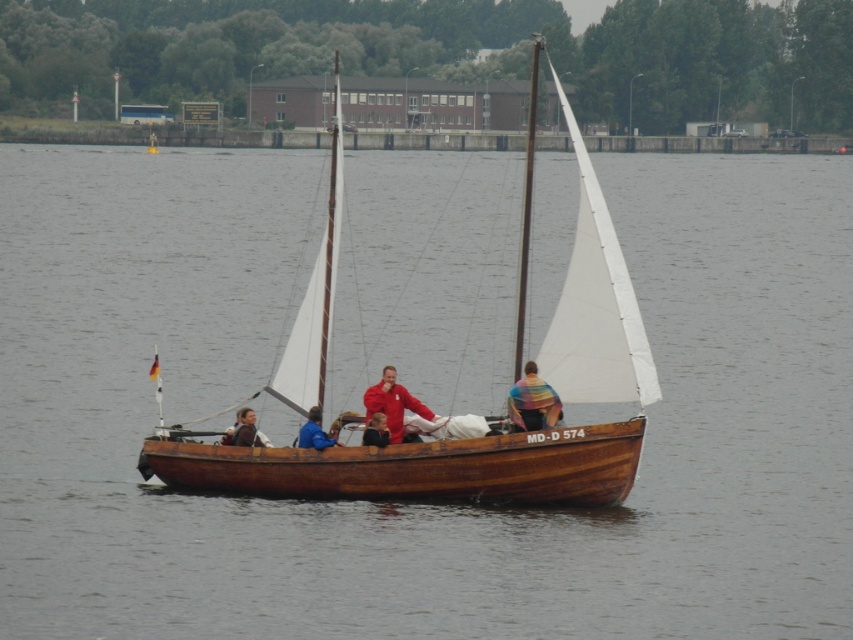
Question: Is matte red jacket at center thinner than brown leather jacket at center?

Choices:
 (A) no
 (B) yes

Answer: (A)

Question: Does rainbow fabric at center have a smaller size compared to matte red jacket at center?

Choices:
 (A) no
 (B) yes

Answer: (B)

Question: Considering the real-world distances, which object is closest to the matte red jacket at center?

Choices:
 (A) rainbow fabric at center
 (B) wooden sailboat at center

Answer: (A)

Question: Which object appears closest to the camera in this image?

Choices:
 (A) wooden sailboat at center
 (B) matte red jacket at center
 (C) brown leather jacket at center

Answer: (A)

Question: Which object is positioned farthest from the blue fabric jacket at center?

Choices:
 (A) smooth brown wooden boat at center
 (B) brown leather jacket at center
 (C) wooden sailboat at center
 (D) rainbow fabric at center

Answer: (C)

Question: Does wooden sailboat at center appear over blue fabric jacket at center?

Choices:
 (A) yes
 (B) no

Answer: (A)